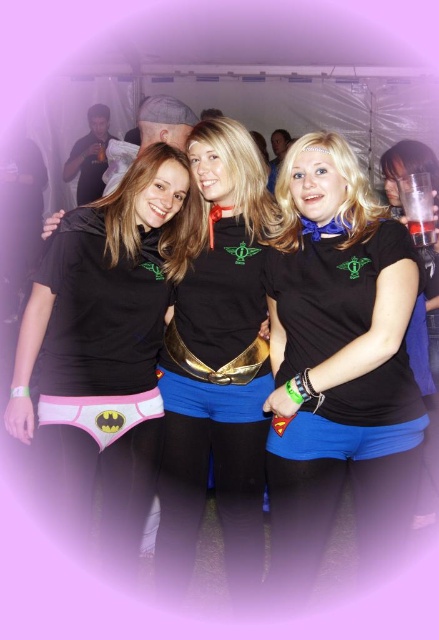
Is blue matte shorts at center to the left of blue matte shorts at right from the viewer's perspective?

Correct, you'll find blue matte shorts at center to the left of blue matte shorts at right.

Is blue matte shorts at center to the right of blue matte shorts at right from the viewer's perspective?

No, blue matte shorts at center is not to the right of blue matte shorts at right.

Where is `blue matte shorts at center`? The image size is (439, 640). blue matte shorts at center is located at coordinates (338, 362).

I want to click on blue matte shorts at center, so click(338, 362).

Between blue matte shorts at center and pink fabric underwear at left, which one is positioned lower?

blue matte shorts at center

Can you confirm if blue matte shorts at center is taller than pink fabric underwear at left?

Indeed, blue matte shorts at center has a greater height compared to pink fabric underwear at left.

Find the location of a particular element. blue matte shorts at center is located at coordinates (338, 362).

Does pink fabric underwear at left have a lesser height compared to pink fabric underwear at lower left?

No.

Does pink fabric underwear at left have a larger size compared to pink fabric underwear at lower left?

Yes, pink fabric underwear at left is bigger than pink fabric underwear at lower left.

The height and width of the screenshot is (640, 439). In order to click on pink fabric underwear at left in this screenshot , I will do click(107, 337).